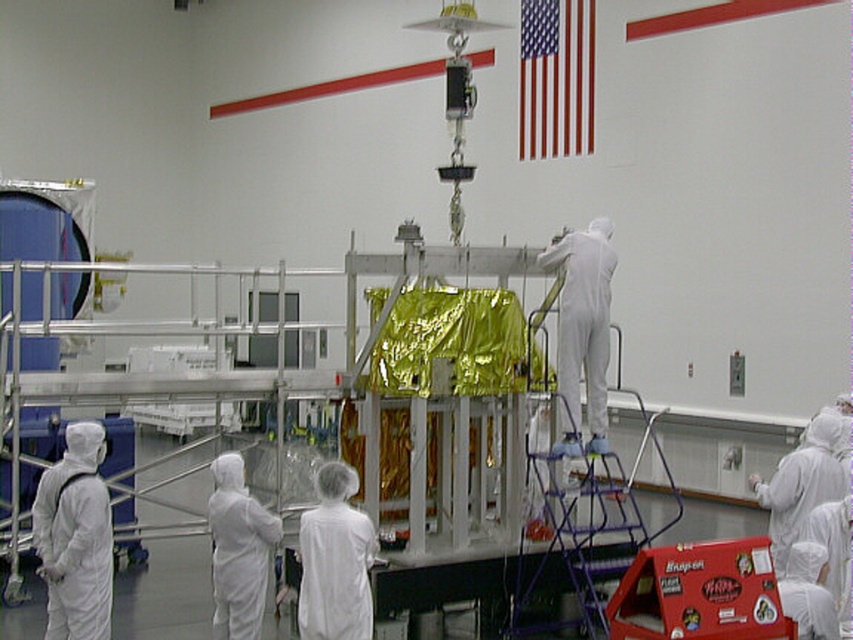
Is point (363, 548) closer to camera compared to point (218, 637)?

That is True.

Based on the photo, does white matte lab coat at center have a lesser height compared to white matte suit at lower left?

Correct, white matte lab coat at center is not as tall as white matte suit at lower left.

Is point (364, 621) closer to camera compared to point (244, 516)?

Yes, point (364, 621) is in front of point (244, 516).

Locate an element on the screen. This screenshot has height=640, width=853. white matte lab coat at center is located at coordinates (335, 561).

Is point (746, 550) positioned behind point (572, 388)?

No, it is not.

This screenshot has height=640, width=853. Describe the element at coordinates (699, 593) in the screenshot. I see `red cardboard box at center` at that location.

Locate an element on the screen. This screenshot has height=640, width=853. red cardboard box at center is located at coordinates (699, 593).

Does red cardboard box at center have a smaller size compared to red fabric flag at upper right?

Correct, red cardboard box at center occupies less space than red fabric flag at upper right.

Which is more to the left, red cardboard box at center or red fabric flag at upper right?

red cardboard box at center is more to the left.

Who is more forward, [776,605] or [537,124]?

Point [776,605] is more forward.

Find the location of a particular element. This screenshot has height=640, width=853. red cardboard box at center is located at coordinates (699, 593).